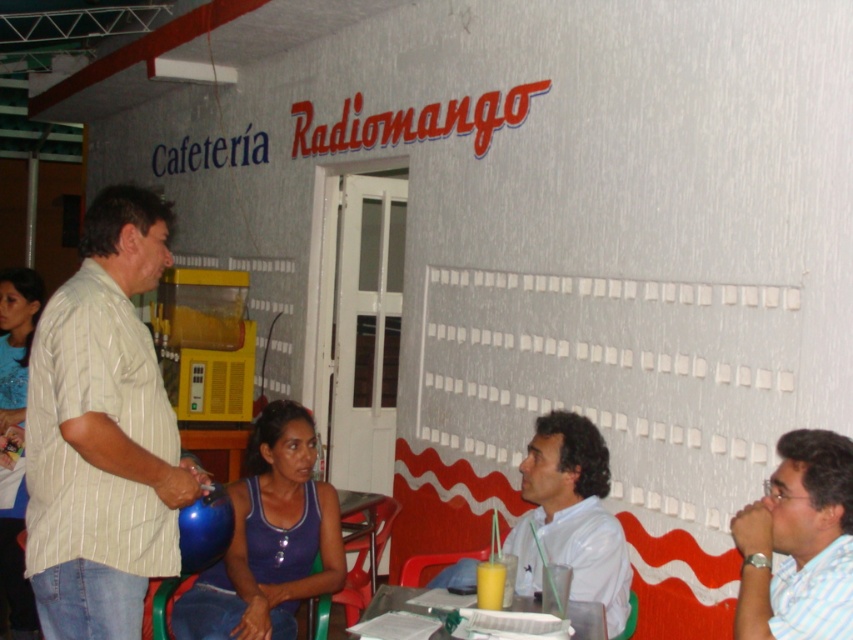
Question: Which point is farther from the camera taking this photo?

Choices:
 (A) (125, 202)
 (B) (576, 624)

Answer: (A)

Question: Can you confirm if striped cotton shirt at left is bigger than white striped shirt at lower right?

Choices:
 (A) no
 (B) yes

Answer: (B)

Question: Which object is closer to the camera taking this photo?

Choices:
 (A) blue fabric tank top at center
 (B) white striped shirt at lower right

Answer: (B)

Question: Can you confirm if striped cotton shirt at left is smaller than blue fabric tank top at center?

Choices:
 (A) no
 (B) yes

Answer: (B)

Question: Which of these objects is positioned closest to the striped cotton shirt at left?

Choices:
 (A) blue sequined tank top at center
 (B) white glossy shirt at center
 (C) blue fabric tank top at center
 (D) translucent plastic table at lower center

Answer: (C)

Question: Does white striped shirt at lower right lie behind white glossy shirt at center?

Choices:
 (A) no
 (B) yes

Answer: (A)